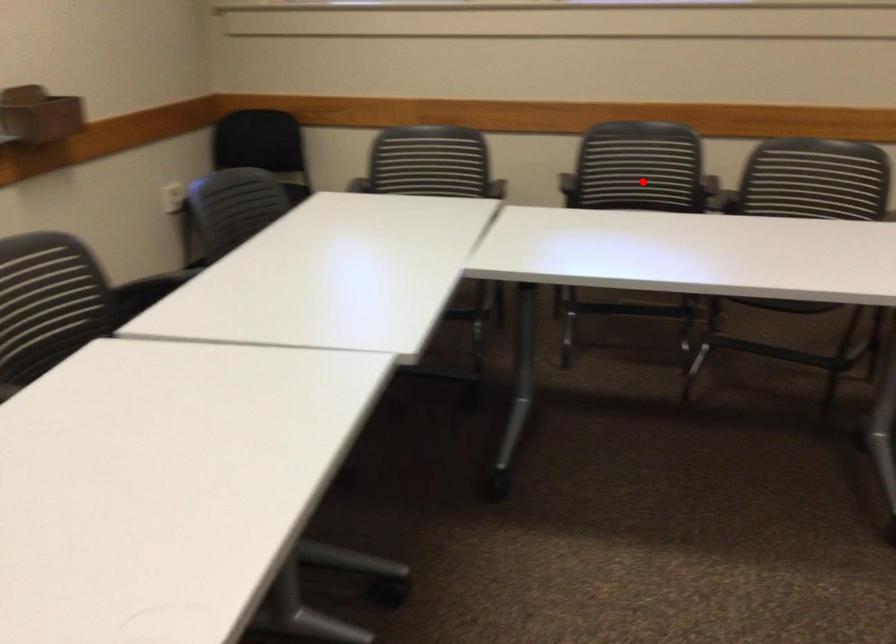
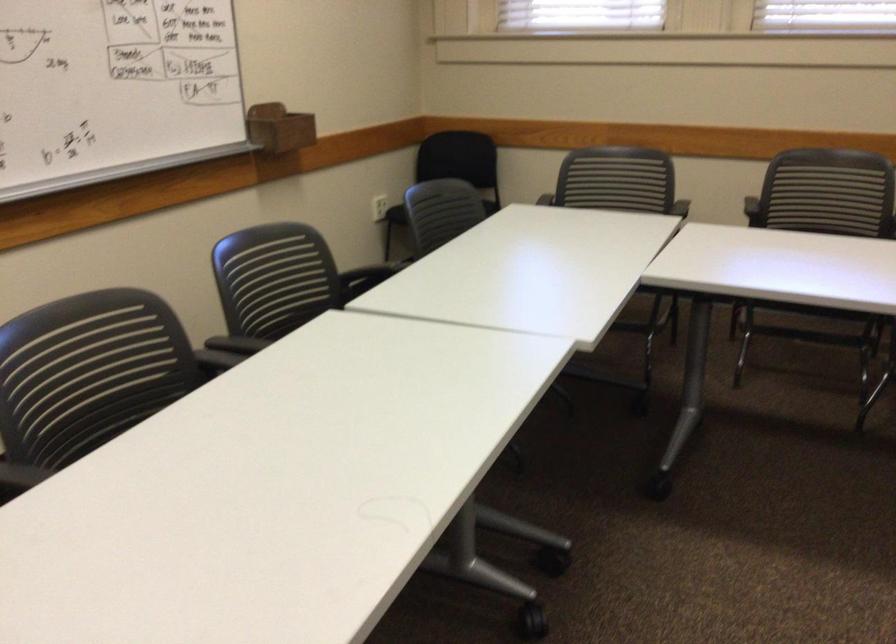
Question: I am providing you with two images of the same scene from different viewpoints. A red point is marked on the first image. Is the red point's position out of view in image 2?

Choices:
 (A) Yes
 (B) No

Answer: (B)